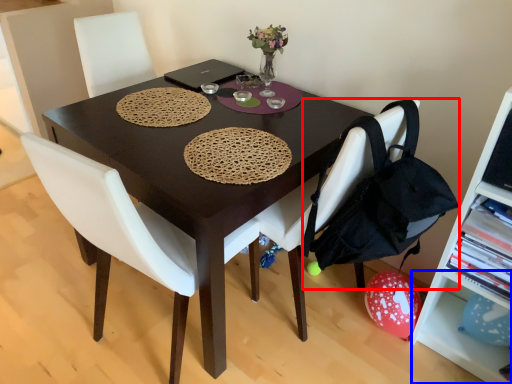
Question: Which object is closer to the camera taking this photo, handbag (highlighted by a red box) or shelf (highlighted by a blue box)?

Choices:
 (A) handbag
 (B) shelf

Answer: (A)